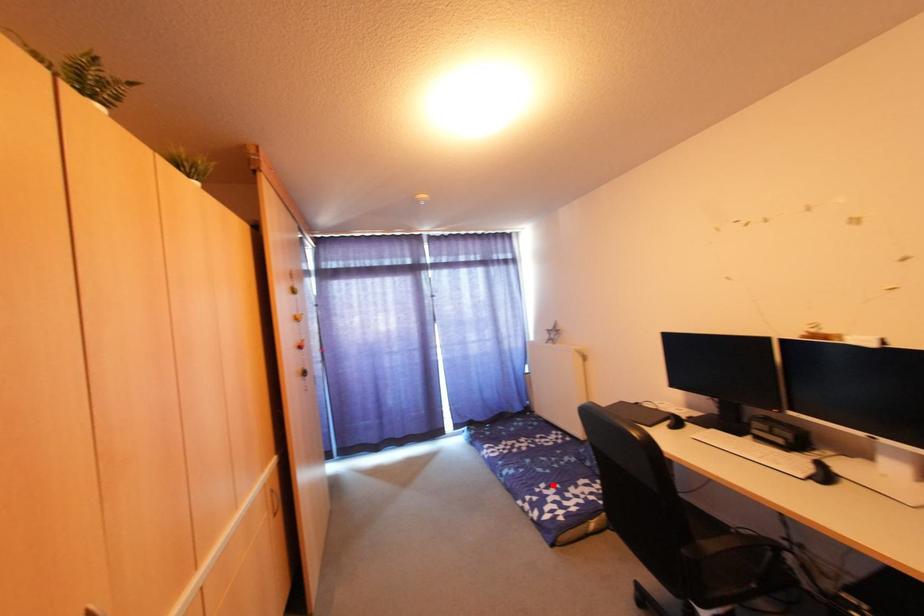
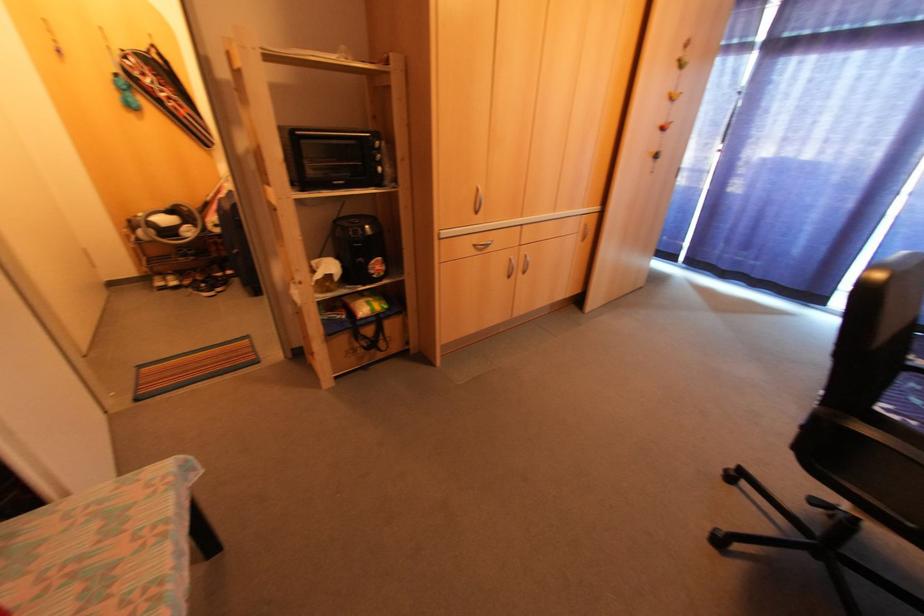
The point at the highlighted location is marked in the first image. Where is the corresponding point in the second image?

(906, 419)